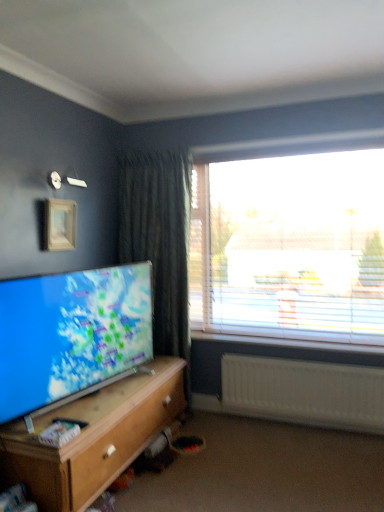
Question: Is wooden cabinet at lower left spatially inside black plastic remote control at lower left, or outside of it?

Choices:
 (A) inside
 (B) outside

Answer: (B)

Question: Looking at the image, does wooden cabinet at lower left seem bigger or smaller compared to black plastic remote control at lower left?

Choices:
 (A) small
 (B) big

Answer: (B)

Question: Based on their relative distances, which object is nearer to the white plastic radiator at lower right?

Choices:
 (A) black plastic remote control at lower left
 (B) transparent plastic window at upper right
 (C) matte screen tv at lower left
 (D) wooden picture frame at upper left
 (E) wooden cabinet at lower left

Answer: (B)

Question: Which of these objects is positioned farthest from the wooden picture frame at upper left?

Choices:
 (A) black plastic remote control at lower left
 (B) transparent plastic window at upper right
 (C) matte screen tv at lower left
 (D) wooden cabinet at lower left
 (E) white plastic window sill at right

Answer: (E)